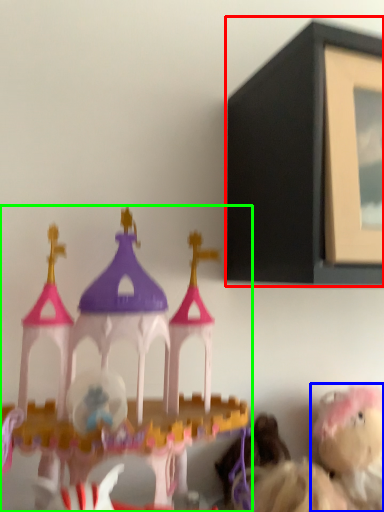
Question: Which object is the closest to the picture frame (highlighted by a red box)? Choose among these: toy (highlighted by a blue box) or toy (highlighted by a green box).

Choices:
 (A) toy
 (B) toy

Answer: (B)